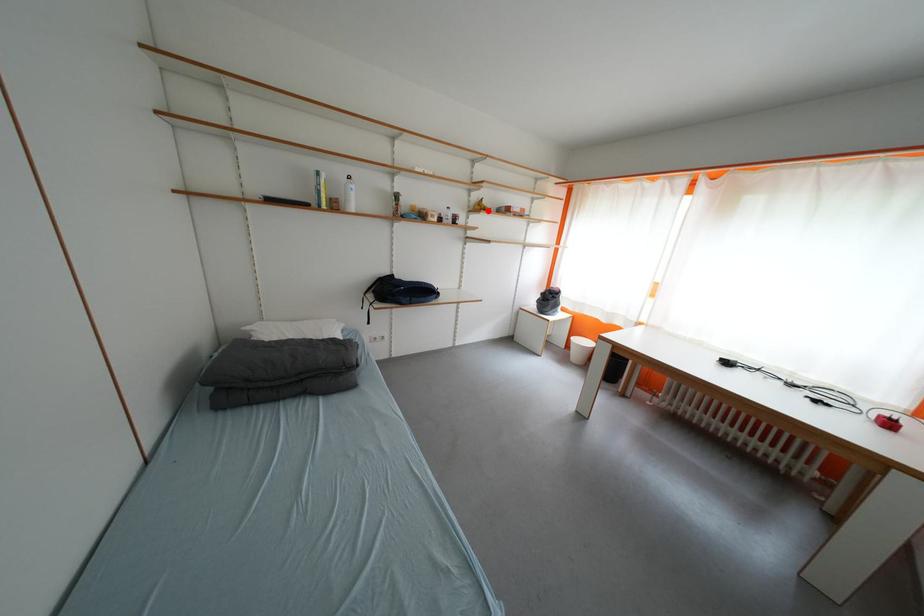
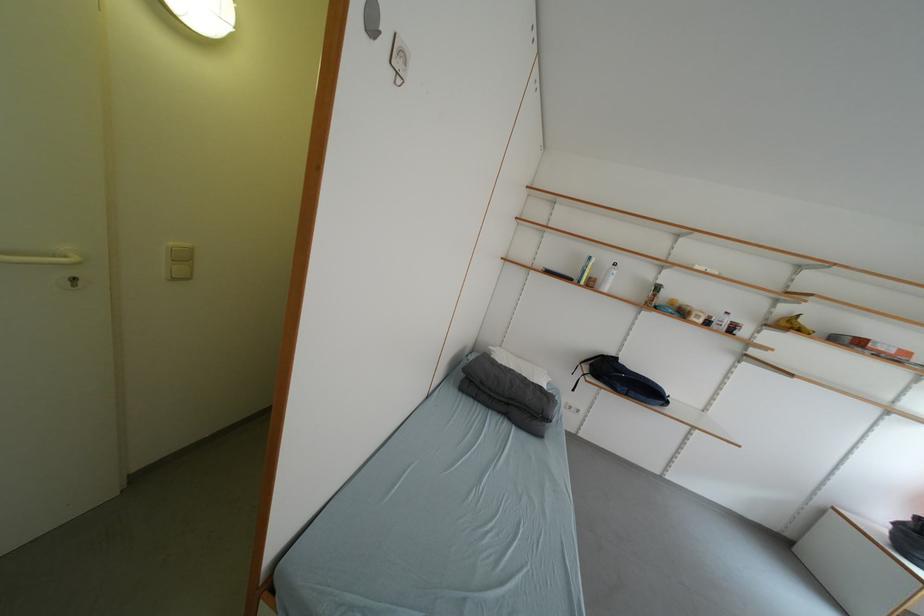
Question: I am providing you with two images of the same scene from different viewpoints. A red point is shown in image1. For the corresponding object point in image2, is it positioned nearer or farther from the camera?

Choices:
 (A) Nearer
 (B) Farther

Answer: (B)